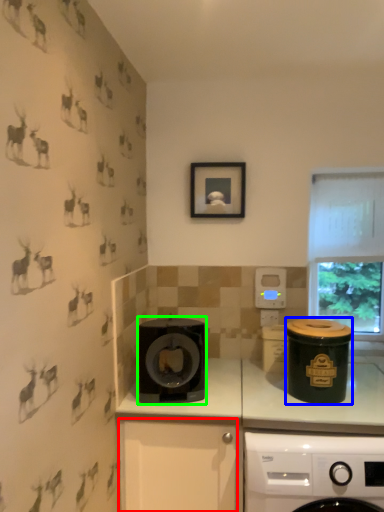
Question: Estimate the real-world distances between objects in this image. Which object is closer to drawer (highlighted by a red box), appliance (highlighted by a blue box) or kitchen appliance (highlighted by a green box)?

Choices:
 (A) appliance
 (B) kitchen appliance

Answer: (B)